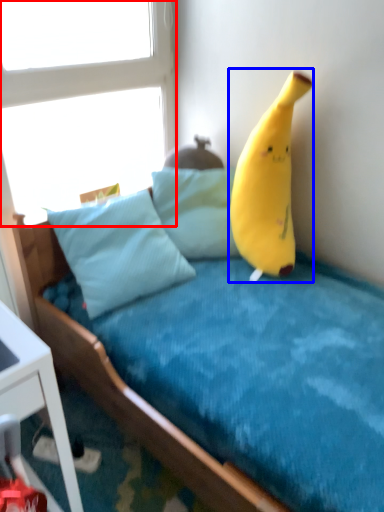
Question: Which object is further to the camera taking this photo, window (highlighted by a red box) or banana (highlighted by a blue box)?

Choices:
 (A) window
 (B) banana

Answer: (A)